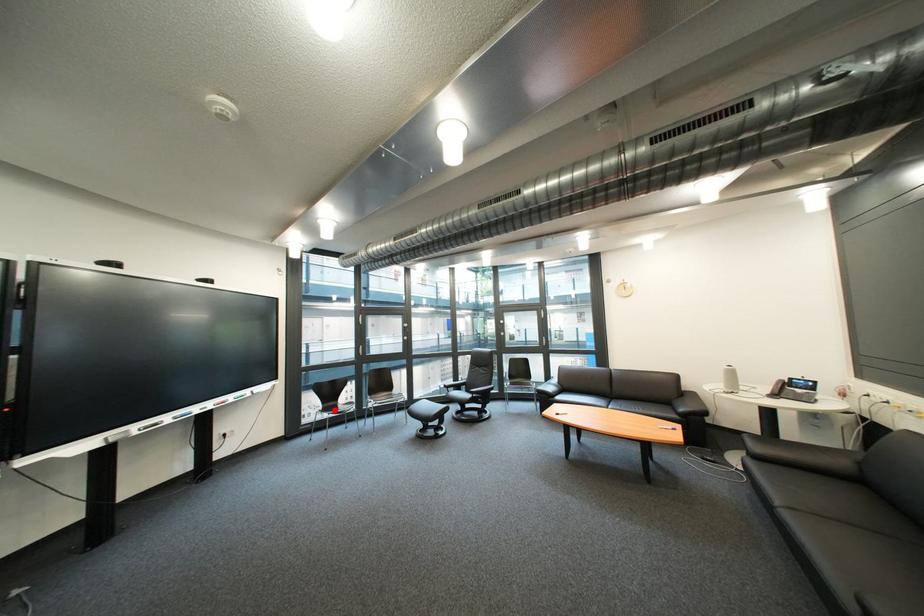
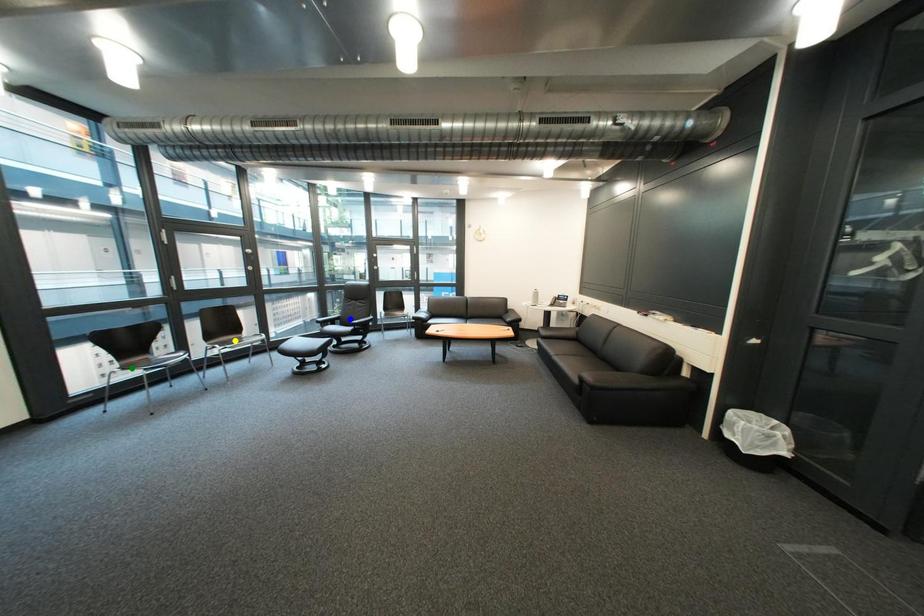
Question: I am providing you with two images of the same scene from different viewpoints. A red point is marked on the first image. You are given multiple points on the second image. In image 2, which mark is for the same physical point as the one in image 1?

Choices:
 (A) blue point
 (B) green point
 (C) yellow point

Answer: (B)